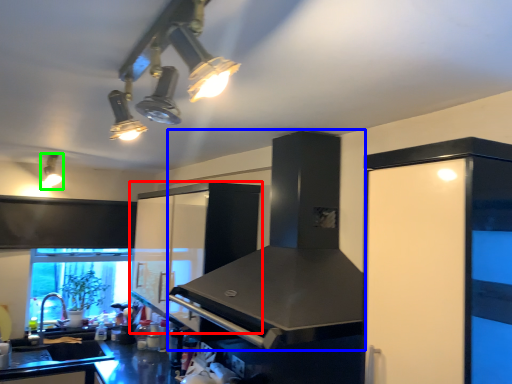
Question: Which is nearer to the cabinetry (highlighted by a red box)? vent (highlighted by a blue box) or light fixture (highlighted by a green box).

Choices:
 (A) vent
 (B) light fixture

Answer: (A)